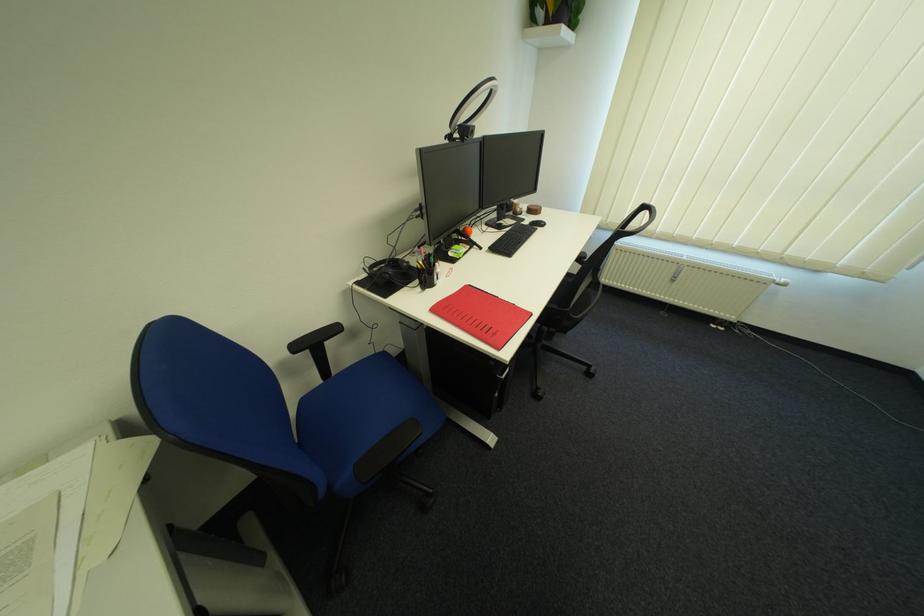
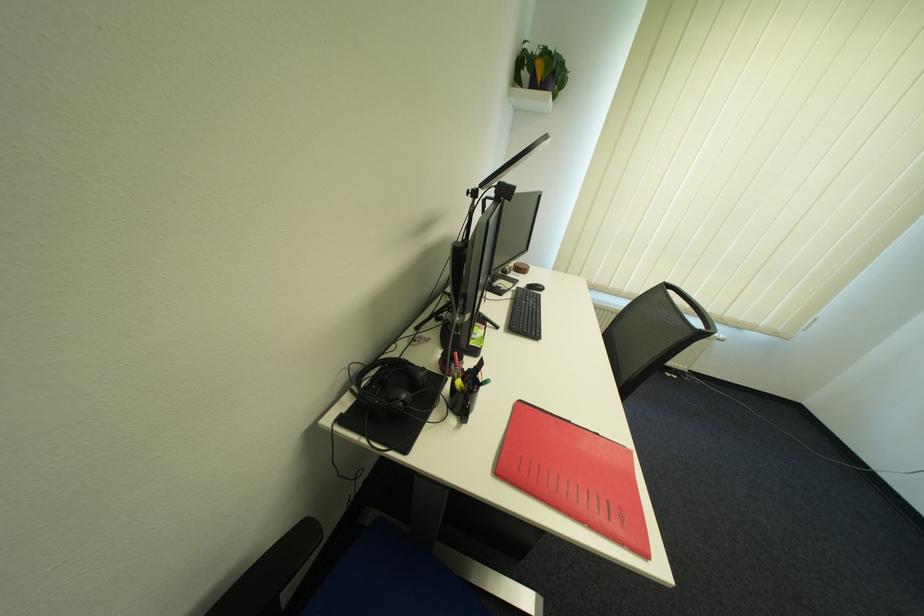
Question: The camera is either moving clockwise (left) or counter-clockwise (right) around the object. The first image is from the beginning of the video and the second image is from the end. Is the camera moving left or right when shooting the video?

Choices:
 (A) Left
 (B) Right

Answer: (A)